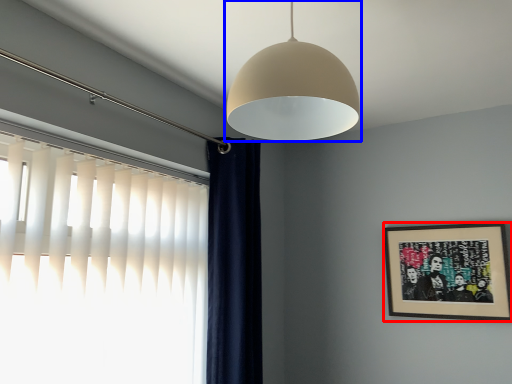
Question: Which object is closer to the camera taking this photo, picture frame (highlighted by a red box) or lamp (highlighted by a blue box)?

Choices:
 (A) picture frame
 (B) lamp

Answer: (B)